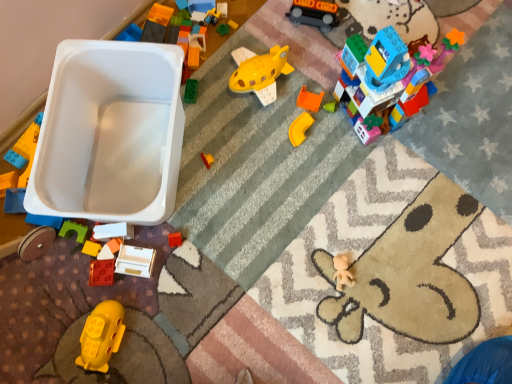
The width and height of the screenshot is (512, 384). Find the location of `vacant point to the left of rubber brick at lower left, positioned as the seventh toy in right-to-left order`. vacant point to the left of rubber brick at lower left, positioned as the seventh toy in right-to-left order is located at coordinates (47, 290).